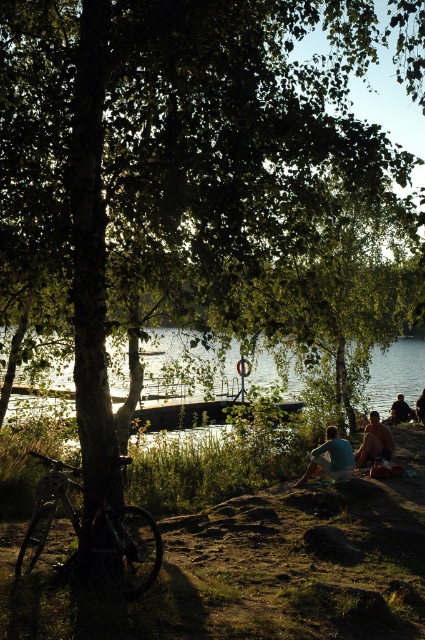
Is point (150, 573) closer to camera compared to point (401, 403)?

That is True.

Who is lower down, shiny metallic bicycle at lower left or dark blue jeans at lower right?

dark blue jeans at lower right is lower down.

Find the location of a particular element. Image resolution: width=425 pixels, height=640 pixels. shiny metallic bicycle at lower left is located at coordinates (93, 531).

Who is taller, blue cotton shirt at center or dark blue jeans at lower right?

Standing taller between the two is blue cotton shirt at center.

Can you confirm if blue cotton shirt at center is shorter than dark blue jeans at lower right?

In fact, blue cotton shirt at center may be taller than dark blue jeans at lower right.

Which is behind, point (337, 435) or point (410, 406)?

The point (410, 406) is more distant.

Find the location of a particular element. This screenshot has height=640, width=425. blue cotton shirt at center is located at coordinates (331, 458).

Which of these two, dark blue jeans at lower right or light brown wooden bench at lower right, stands taller?

dark blue jeans at lower right

In the scene shown: Can you confirm if dark blue jeans at lower right is bigger than light brown wooden bench at lower right?

Correct, dark blue jeans at lower right is larger in size than light brown wooden bench at lower right.

At what (x,y) coordinates should I click in order to perform the action: click on dark blue jeans at lower right. Please return your answer as a coordinate pair (x, y). Looking at the image, I should click on (401, 410).